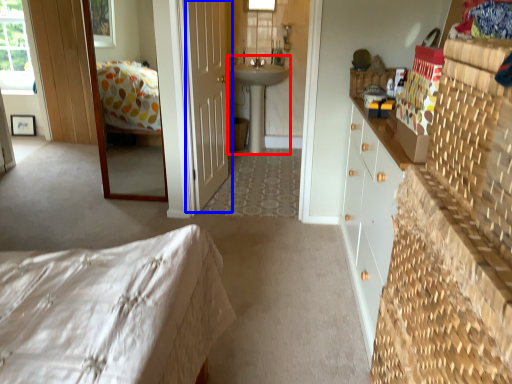
Question: Which point is further to the camera, sink (highlighted by a red box) or door (highlighted by a blue box)?

Choices:
 (A) sink
 (B) door

Answer: (A)